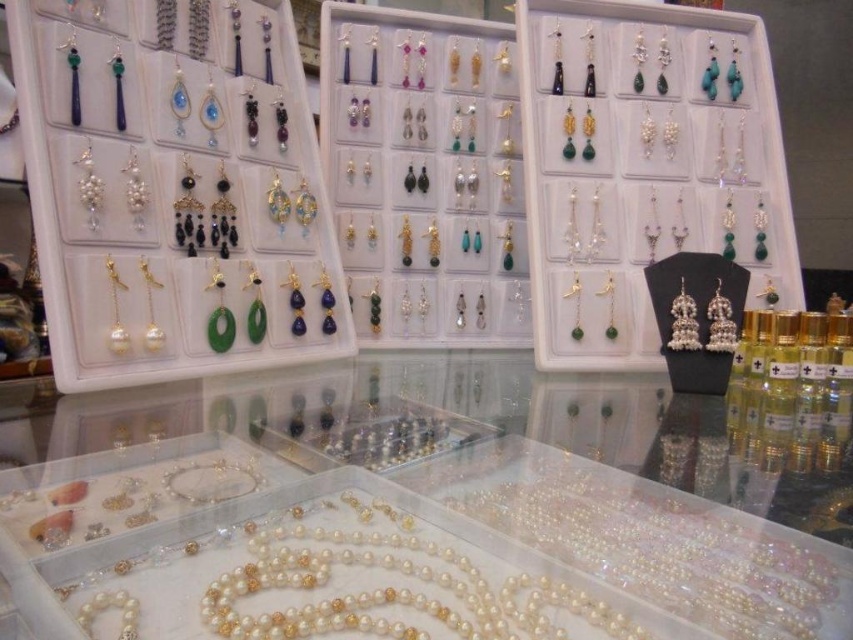
Can you confirm if pearl/golden earrings at left is positioned to the right of shiny silver earrings at center?

In fact, pearl/golden earrings at left is to the left of shiny silver earrings at center.

Which is behind, point (271, 189) or point (360, 264)?

Positioned behind is point (360, 264).

Measure the distance between pearl/golden earrings at left and camera.

They are 1.04 meters apart.

Find the location of a particular element. This screenshot has width=853, height=640. pearl/golden earrings at left is located at coordinates (178, 184).